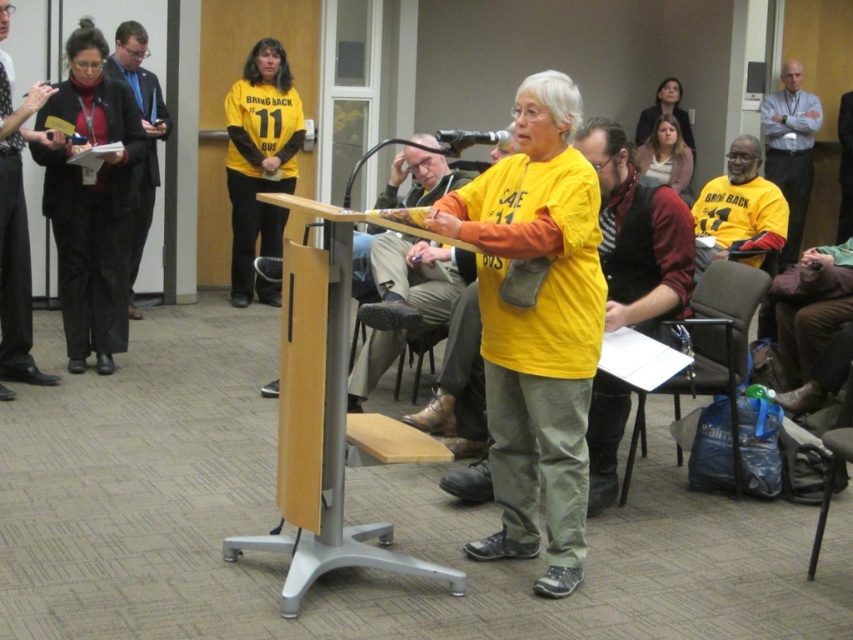
From the picture: Which of these two, gray fabric chair at lower right or black leather jacket at upper right, stands taller?

With more height is black leather jacket at upper right.

The image size is (853, 640). What do you see at coordinates (718, 330) in the screenshot?
I see `gray fabric chair at lower right` at bounding box center [718, 330].

This screenshot has width=853, height=640. I want to click on gray fabric chair at lower right, so click(718, 330).

Who is higher up, black textured tie at left or black leather jacket at upper right?

black leather jacket at upper right

What do you see at coordinates (16, 230) in the screenshot? The width and height of the screenshot is (853, 640). I see `black textured tie at left` at bounding box center [16, 230].

Identify the location of black textured tie at left. (16, 230).

Does yellow jersey at center have a smaller size compared to black textured tie at left?

Incorrect, yellow jersey at center is not smaller in size than black textured tie at left.

Between yellow jersey at center and black textured tie at left, which one appears on the left side from the viewer's perspective?

black textured tie at left

The height and width of the screenshot is (640, 853). I want to click on yellow jersey at center, so click(260, 163).